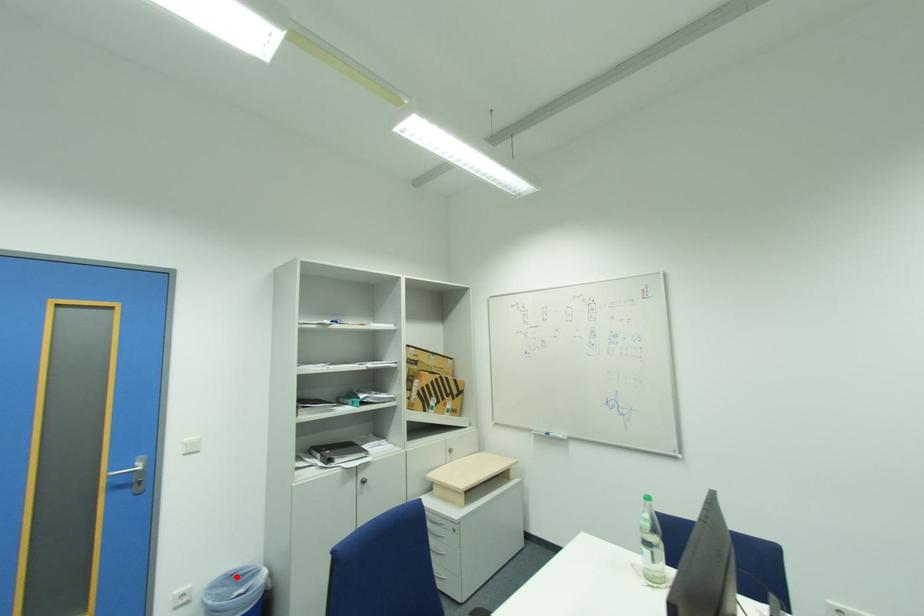
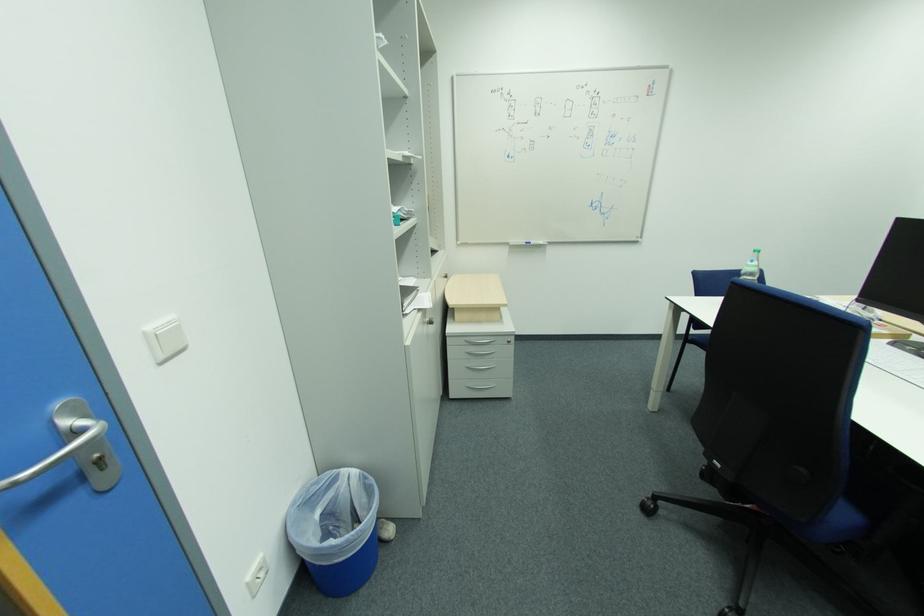
Where in the second image is the point corresponding to the highlighted location from the first image?

(304, 507)